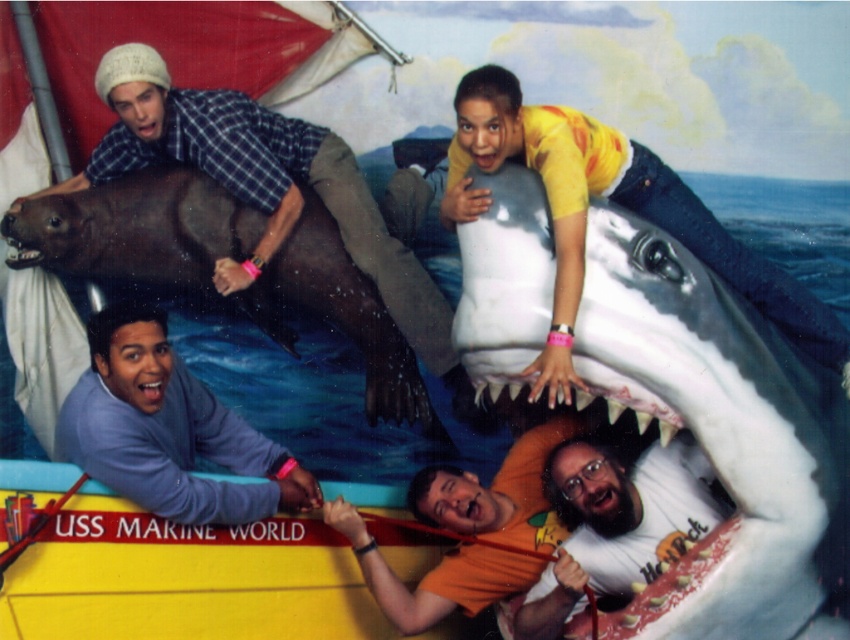
Question: From the image, what is the correct spatial relationship of smooth brown seal at upper left in relation to white matte t-shirt at lower center?

Choices:
 (A) below
 (B) above

Answer: (B)

Question: Which of the following is the closest to the observer?

Choices:
 (A) (469, 148)
 (B) (178, 381)

Answer: (A)

Question: Which point is closer to the camera taking this photo?

Choices:
 (A) (813, 435)
 (B) (136, 401)

Answer: (B)

Question: Is yellow t-shirt at upper center bigger than orange matte shirt at lower center?

Choices:
 (A) no
 (B) yes

Answer: (B)

Question: Which point is closer to the camera?

Choices:
 (A) (486, 170)
 (B) (201, 506)

Answer: (A)

Question: Is white matte t-shirt at lower center behind pink matte mouth at lower left?

Choices:
 (A) yes
 (B) no

Answer: (B)